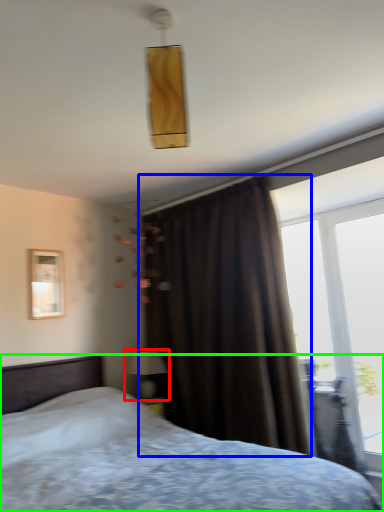
Question: Which object is the closest to the table lamp (highlighted by a red box)? Choose among these: curtain (highlighted by a blue box) or bed (highlighted by a green box).

Choices:
 (A) curtain
 (B) bed

Answer: (A)